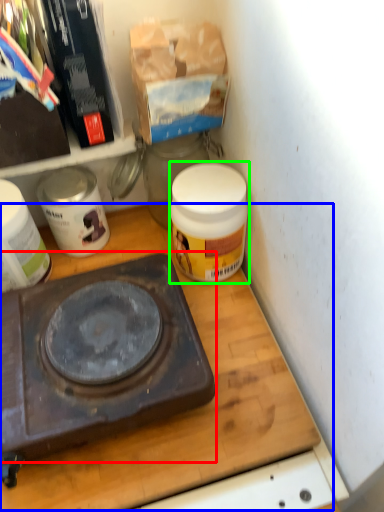
Question: Which is farther away from gas stove (highlighted by a red box)? table (highlighted by a blue box) or product (highlighted by a green box)?

Choices:
 (A) table
 (B) product

Answer: (B)